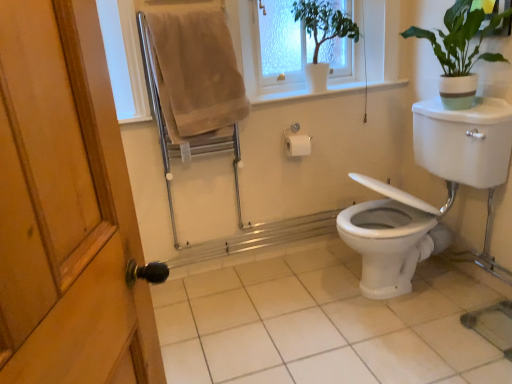
Question: In the image, is beige cotton towel at upper left on the left side or the right side of white glossy toilet at lower right?

Choices:
 (A) right
 (B) left

Answer: (B)

Question: Considering the positions of beige cotton towel at upper left and white glossy toilet at lower right in the image, is beige cotton towel at upper left taller or shorter than white glossy toilet at lower right?

Choices:
 (A) short
 (B) tall

Answer: (A)

Question: Based on their relative distances, which object is farther from the white glossy pot at upper center, the second houseplant from the right?

Choices:
 (A) white glossy toilet at lower right
 (B) white glossy tile at center
 (C) white plastic window frame at upper center
 (D) beige cotton towel at upper left
 (E) green matte plant at upper right, acting as the 1th houseplant starting from the right

Answer: (B)

Question: Which of these objects is positioned closest to the beige cotton towel at upper left?

Choices:
 (A) white glossy tile at center
 (B) white glossy pot at upper center, the second houseplant from the right
 (C) white glossy toilet at lower right
 (D) white plastic window frame at upper center
 (E) green matte plant at upper right, the second houseplant from the left

Answer: (D)